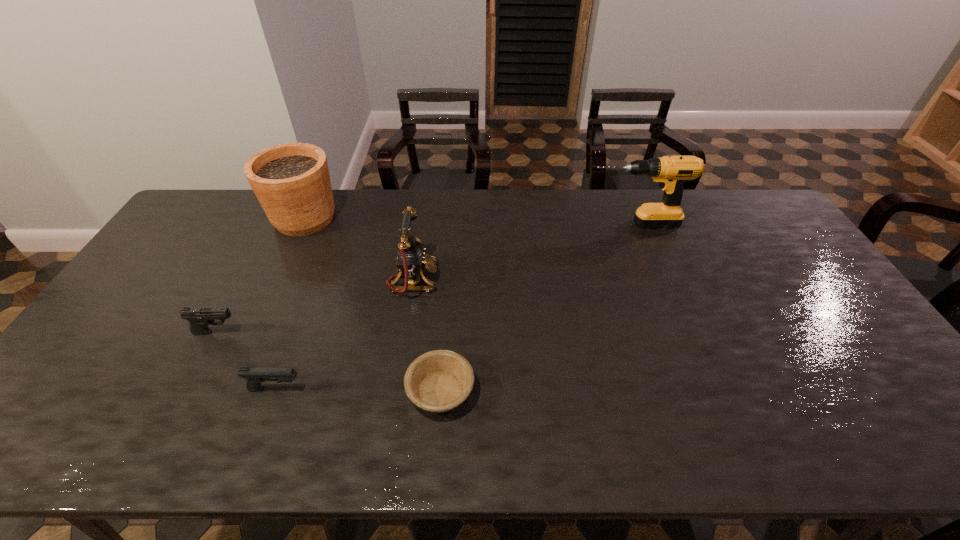
The height and width of the screenshot is (540, 960). Identify the location of vacant region between the right pistol and the fourth nearest object. (345, 334).

Locate an element on the screen. This screenshot has width=960, height=540. unoccupied area between the left pistol and the flowerpot is located at coordinates (260, 275).

Where is `free spot between the fourth farthest object and the bowl`? free spot between the fourth farthest object and the bowl is located at coordinates (328, 361).

Identify which object is located as the nearest to the flowerpot. Please provide its 2D coordinates. Your answer should be formatted as a tuple, i.e. [(x, y)], where the tuple contains the x and y coordinates of a point satisfying the conditions above.

[(411, 256)]

Find the location of `object that stands as the fifth closest to the fourth farthest object`. object that stands as the fifth closest to the fourth farthest object is located at coordinates (671, 172).

Find the location of `vacant region that satisfies the following two spatial constraints: 1. on the back side of the shortest object; 2. on the front of the third farthest object, featuring the rotary dial`. vacant region that satisfies the following two spatial constraints: 1. on the back side of the shortest object; 2. on the front of the third farthest object, featuring the rotary dial is located at coordinates (448, 279).

Locate an element on the screen. The height and width of the screenshot is (540, 960). vacant space that satisfies the following two spatial constraints: 1. on the front side of the flowerpot; 2. at the barrel of the left pistol is located at coordinates (252, 332).

At what (x,y) coordinates should I click in order to perform the action: click on free spot that satisfies the following two spatial constraints: 1. at the tip of the drill; 2. on the front side of the shortest object. Please return your answer as a coordinate pair (x, y). Looking at the image, I should click on (699, 391).

At what (x,y) coordinates should I click in order to perform the action: click on vacant space that satisfies the following two spatial constraints: 1. on the front of the fourth nearest object, featuring the rotary dial; 2. on the left side of the shortest object. Please return your answer as a coordinate pair (x, y). This screenshot has height=540, width=960. Looking at the image, I should click on (396, 391).

This screenshot has width=960, height=540. Find the location of `free location that satisfies the following two spatial constraints: 1. on the back side of the shortest object; 2. at the barrel of the fourth farthest object`. free location that satisfies the following two spatial constraints: 1. on the back side of the shortest object; 2. at the barrel of the fourth farthest object is located at coordinates (444, 332).